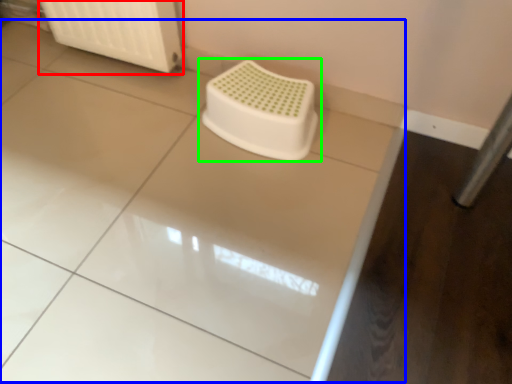
Question: Based on their relative distances, which object is nearer to radiator (highlighted by a red box)? Choose from counter top (highlighted by a blue box) and toilet (highlighted by a green box).

Choices:
 (A) counter top
 (B) toilet

Answer: (B)